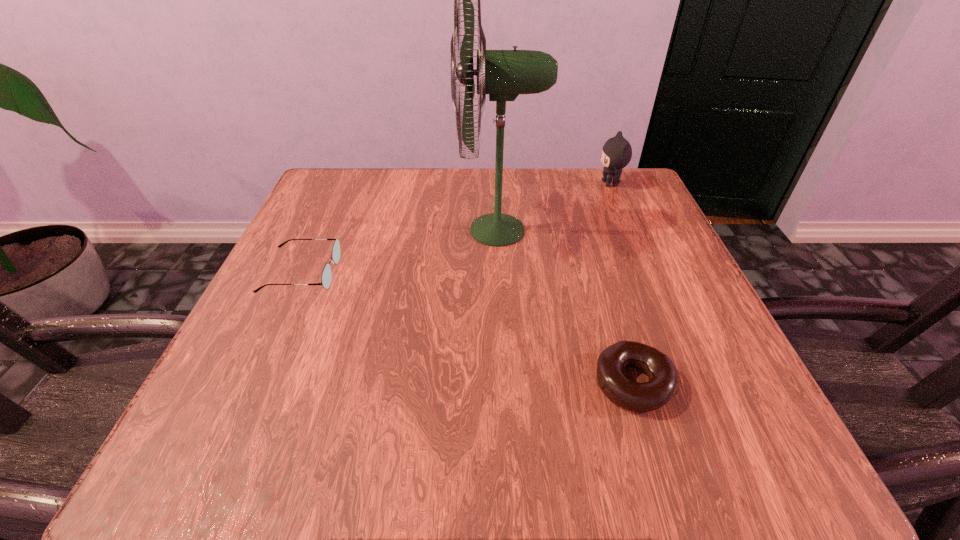
This screenshot has width=960, height=540. I want to click on doughnut present at the right edge, so point(663,384).

Identify the location of object located in the far right corner section of the desktop. Image resolution: width=960 pixels, height=540 pixels. (616, 153).

Locate an element on the screen. object that is at the near right corner is located at coordinates (663, 384).

What are the coordinates of `free spot at the far edge of the desktop` in the screenshot? It's located at (534, 221).

The image size is (960, 540). In the image, there is a desktop. What are the coordinates of `vacant space at the left edge` in the screenshot? It's located at (319, 240).

Locate an element on the screen. blank area at the far left corner is located at coordinates (360, 172).

Where is `free location at the far right corner`? The image size is (960, 540). free location at the far right corner is located at coordinates (593, 170).

Find the location of a particular element. free space at the near right corner of the desktop is located at coordinates (788, 472).

Locate an element on the screen. The image size is (960, 540). free point between the third object from right to left and the kitten is located at coordinates (554, 207).

Find the location of `vacant area that lies between the third object from left to right and the leftmost object`. vacant area that lies between the third object from left to right and the leftmost object is located at coordinates (468, 328).